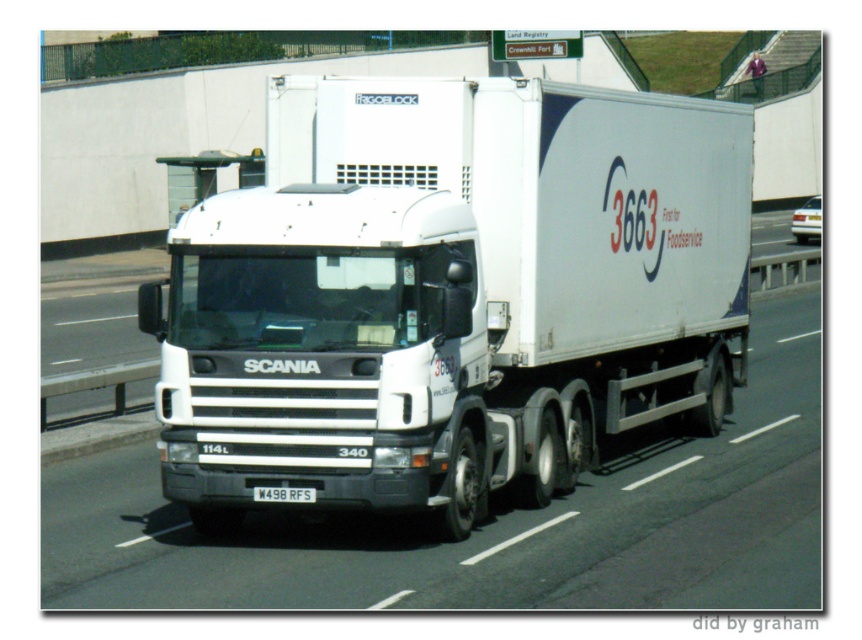
Question: Can you confirm if white matte truck at center is wider than white plastic license plate at center?

Choices:
 (A) no
 (B) yes

Answer: (A)

Question: Can you confirm if metallic silver taxi at right is positioned below white plastic license plate at center?

Choices:
 (A) no
 (B) yes

Answer: (A)

Question: Does metallic silver taxi at right appear on the left side of white plastic license plate at center?

Choices:
 (A) no
 (B) yes

Answer: (A)

Question: Among these objects, which one is farthest from the camera?

Choices:
 (A) white plastic license plate at center
 (B) metallic silver taxi at right
 (C) white matte truck at center

Answer: (B)

Question: Which point is closer to the camera taking this photo?

Choices:
 (A) (311, 100)
 (B) (311, 493)
 (C) (798, 227)

Answer: (B)

Question: Which object is the closest to the white matte truck at center?

Choices:
 (A) metallic silver taxi at right
 (B) white plastic license plate at center

Answer: (B)